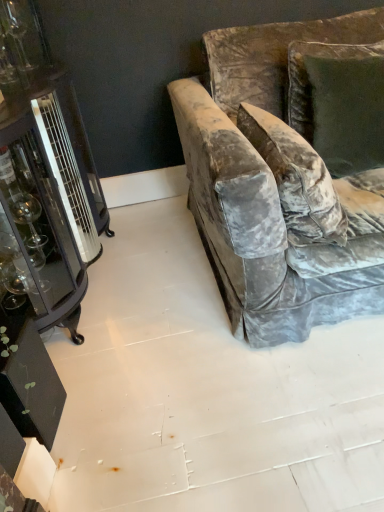
What do you see at coordinates (339, 102) in the screenshot?
I see `velvet green pillow at upper right` at bounding box center [339, 102].

This screenshot has width=384, height=512. I want to click on velvet green pillow at upper right, so click(339, 102).

The width and height of the screenshot is (384, 512). In order to click on velvet green pillow at upper right in this screenshot , I will do `click(339, 102)`.